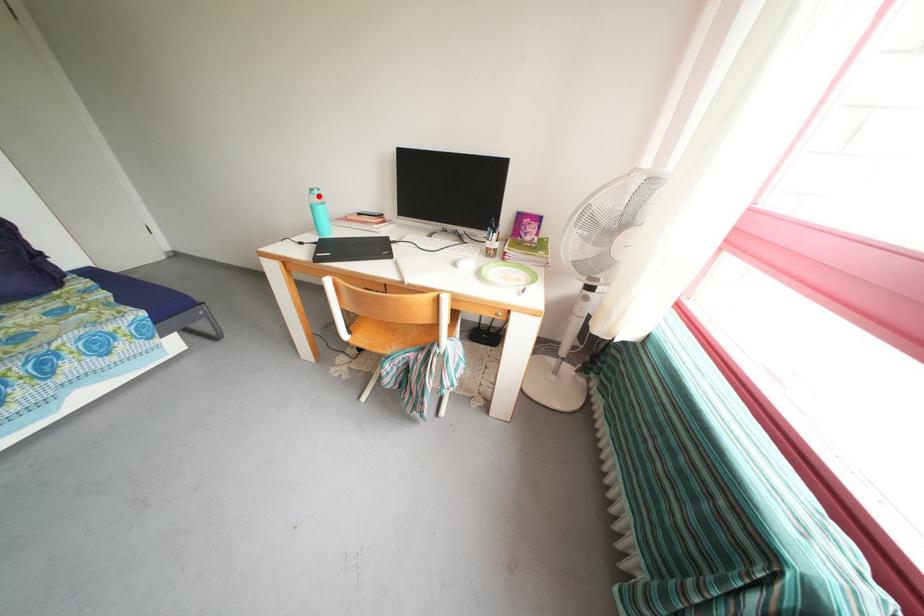
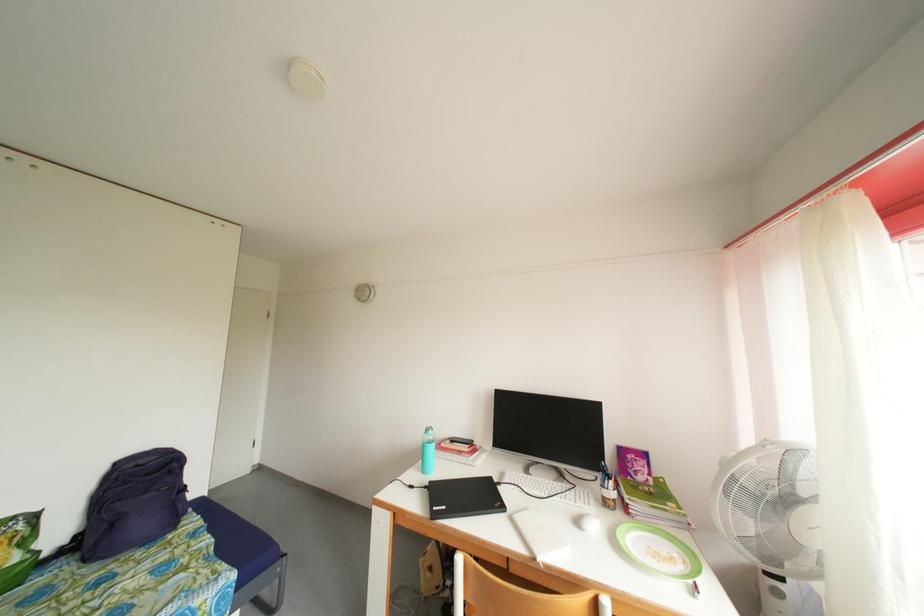
Question: A red point is marked in image1. In image2, is the corresponding 3D point closer to the camera or farther? Reply with the corresponding letter.

Choices:
 (A) The corresponding 3D point is closer.
 (B) The corresponding 3D point is farther.

Answer: (B)